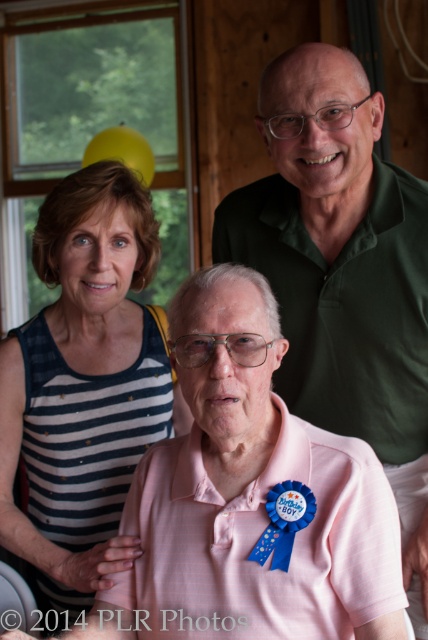
Question: Does green matte shirt at upper center appear on the left side of striped fabric dress at upper left?

Choices:
 (A) no
 (B) yes

Answer: (A)

Question: Which of the following is the farthest from the observer?

Choices:
 (A) (317, 260)
 (B) (83, 282)

Answer: (B)

Question: Which point is closer to the camera taking this photo?

Choices:
 (A) (77, 433)
 (B) (407, 192)

Answer: (B)

Question: Can you confirm if green matte shirt at upper center is positioned to the left of striped fabric dress at upper left?

Choices:
 (A) no
 (B) yes

Answer: (A)

Question: Among these points, which one is nearest to the camera?

Choices:
 (A) (419, 262)
 (B) (41, 394)

Answer: (A)

Question: Is green matte shirt at upper center smaller than striped fabric dress at upper left?

Choices:
 (A) no
 (B) yes

Answer: (A)